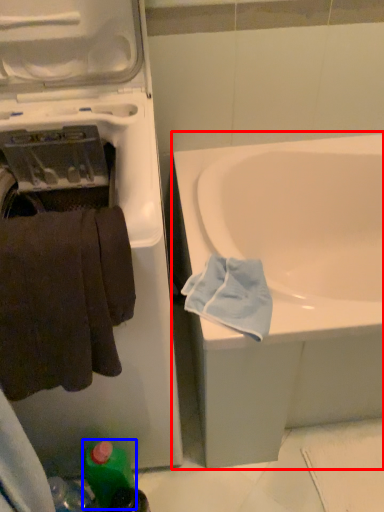
Question: Which object appears closest to the camera in this image, bathtub (highlighted by a red box) or bottle (highlighted by a blue box)?

Choices:
 (A) bathtub
 (B) bottle

Answer: (A)